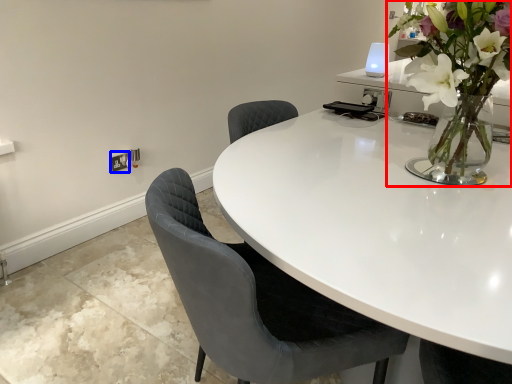
Question: Which point is closer to the camera, houseplant (highlighted by a red box) or electric outlet (highlighted by a blue box)?

Choices:
 (A) houseplant
 (B) electric outlet

Answer: (A)